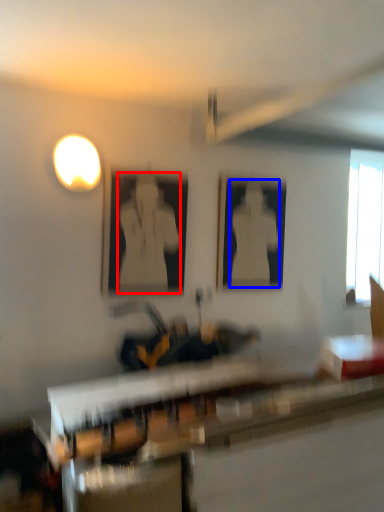
Question: Which object appears farthest to the camera in this image, person (highlighted by a red box) or person (highlighted by a blue box)?

Choices:
 (A) person
 (B) person

Answer: (B)